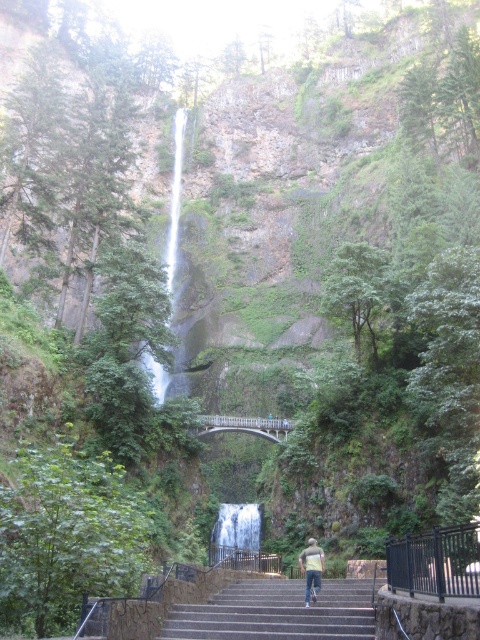
Who is higher up, gray concrete stairs at center or white smooth waterfall at center?

gray concrete stairs at center is higher up.

Does gray concrete stairs at center appear over white smooth waterfall at center?

Indeed, gray concrete stairs at center is positioned over white smooth waterfall at center.

Measure the distance between gray concrete stairs at center and camera.

gray concrete stairs at center is 41.02 meters away from camera.

What are the coordinates of `gray concrete stairs at center` in the screenshot? It's located at (276, 612).

Can you confirm if gray concrete stairs at center is taller than light blue jeans at center?

No, gray concrete stairs at center is not taller than light blue jeans at center.

Who is positioned more to the right, gray concrete stairs at center or light blue jeans at center?

light blue jeans at center

Which is behind, point (232, 611) or point (322, 566)?

The point (322, 566) is behind.

Where is `gray concrete stairs at center`? gray concrete stairs at center is located at coordinates (276, 612).

Between point (261, 579) and point (168, 280), which one is positioned in front?

Positioned in front is point (261, 579).

Measure the distance between gray concrete stairs at center and camera.

gray concrete stairs at center and camera are 41.02 meters apart from each other.

This screenshot has width=480, height=640. I want to click on gray concrete stairs at center, so click(276, 612).